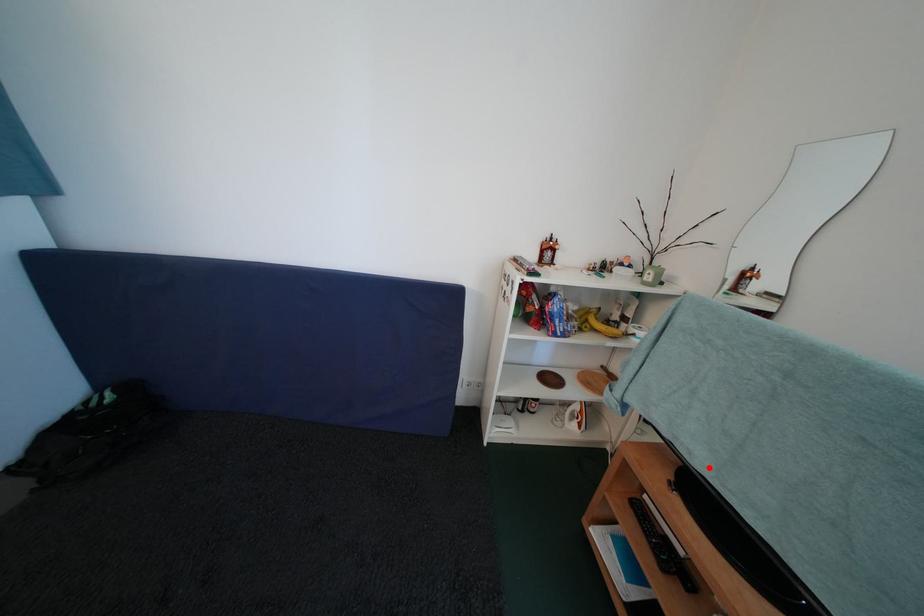
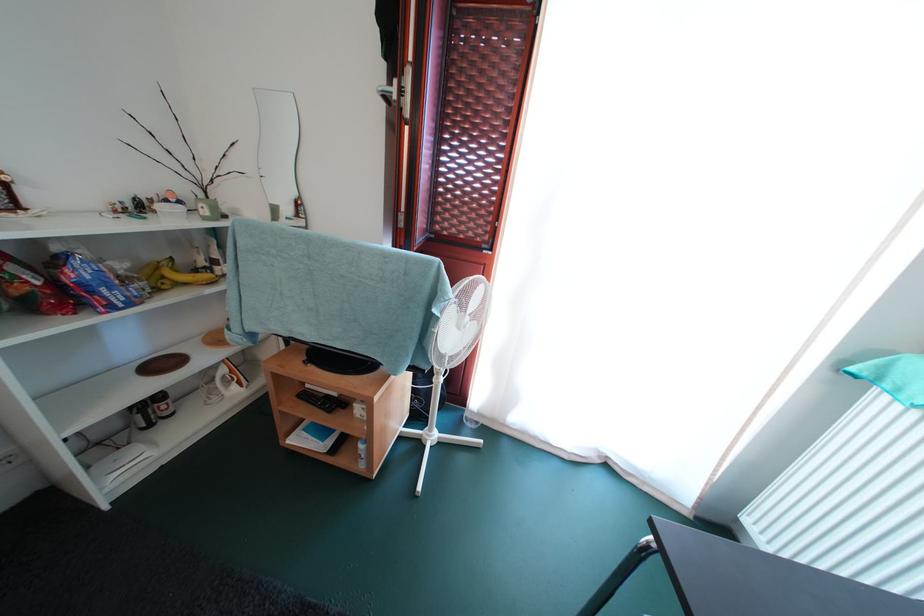
Find the pixel in the second image that matches the highlighted location in the first image.

(318, 341)